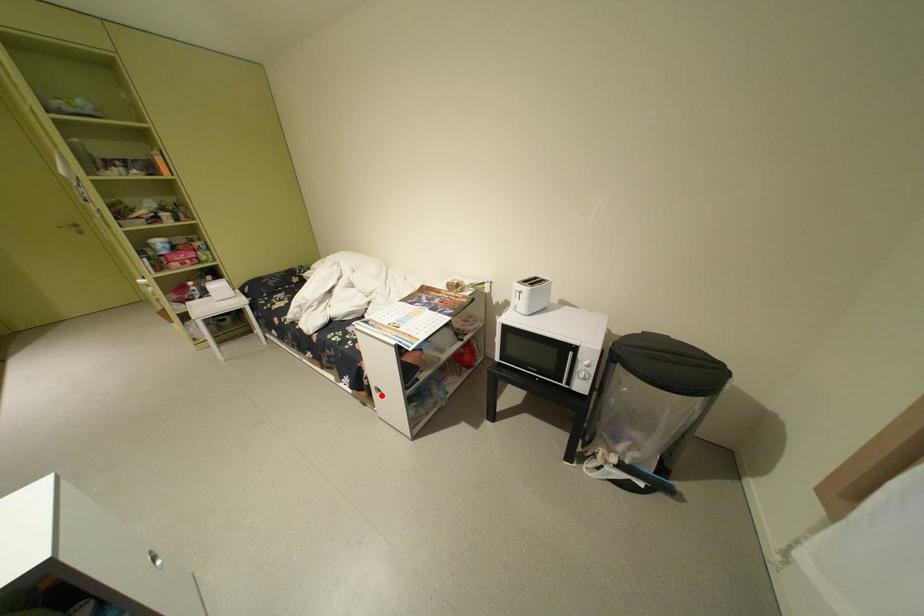
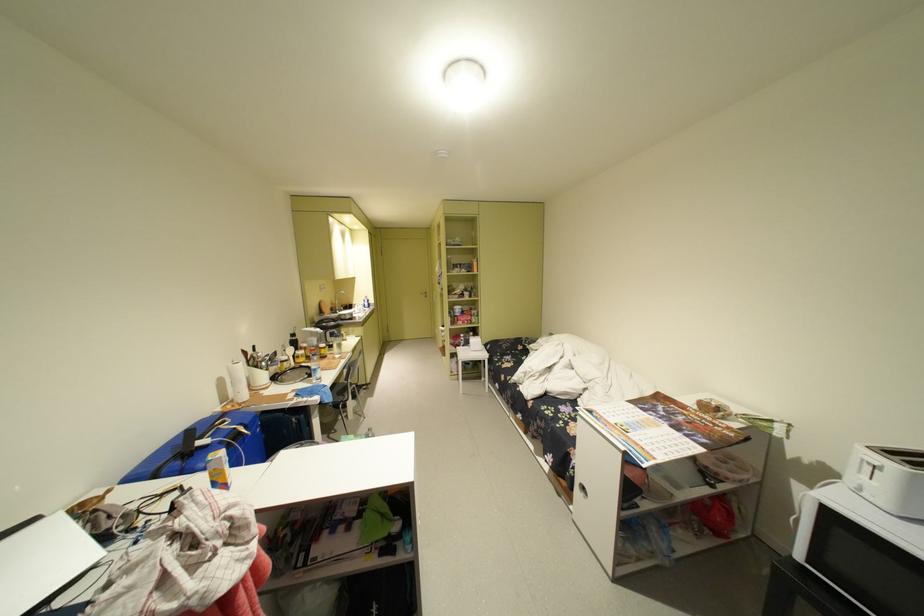
Question: A red point is marked in image1. In image2, is the corresponding 3D point closer to the camera or farther? Reply with the corresponding letter.

Choices:
 (A) The corresponding 3D point is closer.
 (B) The corresponding 3D point is farther.

Answer: (A)